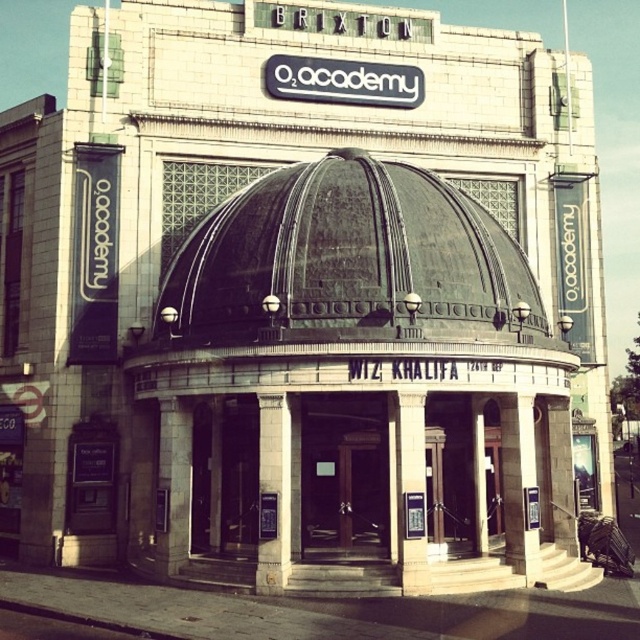
Question: Which object appears closest to the camera in this image?

Choices:
 (A) bronze textured dome at center
 (B) wooden door at center

Answer: (A)

Question: Estimate the real-world distances between objects in this image. Which object is farther from the bronze textured dome at center?

Choices:
 (A) wooden door at center
 (B) white stone pillar at center

Answer: (B)

Question: Is wooden door at center to the right of white stone pillar at center from the viewer's perspective?

Choices:
 (A) yes
 (B) no

Answer: (B)

Question: Is bronze textured dome at center above white stone pillar at center?

Choices:
 (A) yes
 (B) no

Answer: (A)

Question: Which point is farther from the camera taking this photo?

Choices:
 (A) (356, 529)
 (B) (412, 561)
 (C) (228, 200)

Answer: (C)

Question: Is wooden door at center below white stone pillar at center?

Choices:
 (A) yes
 (B) no

Answer: (B)